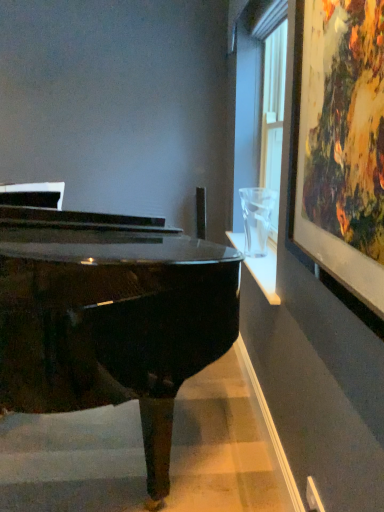
Question: Is the depth of white plastic power outlet at lower right greater than that of wooden framed artwork at upper right?

Choices:
 (A) no
 (B) yes

Answer: (B)

Question: Is white plastic power outlet at lower right not inside wooden framed artwork at upper right?

Choices:
 (A) no
 (B) yes

Answer: (B)

Question: Is white plastic power outlet at lower right facing away from wooden framed artwork at upper right?

Choices:
 (A) no
 (B) yes

Answer: (A)

Question: Considering the relative sizes of white plastic power outlet at lower right and wooden framed artwork at upper right in the image provided, is white plastic power outlet at lower right taller than wooden framed artwork at upper right?

Choices:
 (A) no
 (B) yes

Answer: (A)

Question: From the image's perspective, is white plastic power outlet at lower right beneath wooden framed artwork at upper right?

Choices:
 (A) no
 (B) yes

Answer: (B)

Question: Relative to white plastic power outlet at lower right, is wooden framed artwork at upper right in front or behind?

Choices:
 (A) front
 (B) behind

Answer: (A)

Question: Looking at the image, does wooden framed artwork at upper right seem bigger or smaller compared to white plastic power outlet at lower right?

Choices:
 (A) big
 (B) small

Answer: (A)

Question: Is point (306, 212) positioned closer to the camera than point (317, 507)?

Choices:
 (A) farther
 (B) closer

Answer: (B)

Question: Is wooden framed artwork at upper right wider or thinner than white plastic power outlet at lower right?

Choices:
 (A) wide
 (B) thin

Answer: (A)

Question: Which is correct: glossy black piano at center is inside white plastic power outlet at lower right, or outside of it?

Choices:
 (A) inside
 (B) outside

Answer: (B)

Question: Is glossy black piano at center taller or shorter than white plastic power outlet at lower right?

Choices:
 (A) tall
 (B) short

Answer: (A)

Question: Considering the positions of glossy black piano at center and white plastic power outlet at lower right in the image, is glossy black piano at center bigger or smaller than white plastic power outlet at lower right?

Choices:
 (A) small
 (B) big

Answer: (B)

Question: Is point (51, 236) positioned closer to the camera than point (317, 510)?

Choices:
 (A) farther
 (B) closer

Answer: (B)

Question: From the image's perspective, is wooden framed artwork at upper right positioned above or below glossy black piano at center?

Choices:
 (A) below
 (B) above

Answer: (B)

Question: Which is correct: wooden framed artwork at upper right is inside glossy black piano at center, or outside of it?

Choices:
 (A) outside
 (B) inside

Answer: (A)